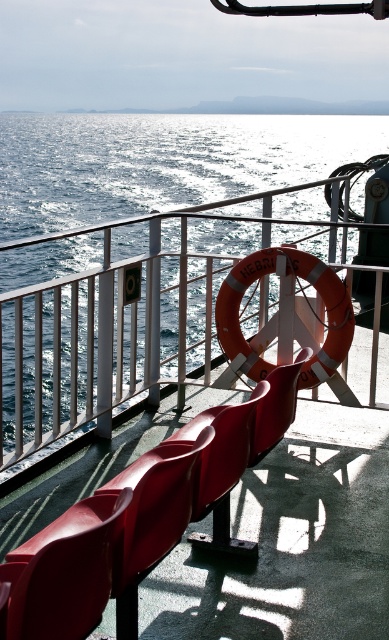
Question: Where is blue water at center located in relation to matte plastic chair at center in the image?

Choices:
 (A) right
 (B) left

Answer: (B)

Question: Does blue water at center have a larger size compared to matte plastic chair at center?

Choices:
 (A) no
 (B) yes

Answer: (B)

Question: Does blue water at center have a greater width compared to matte plastic chair at center?

Choices:
 (A) no
 (B) yes

Answer: (B)